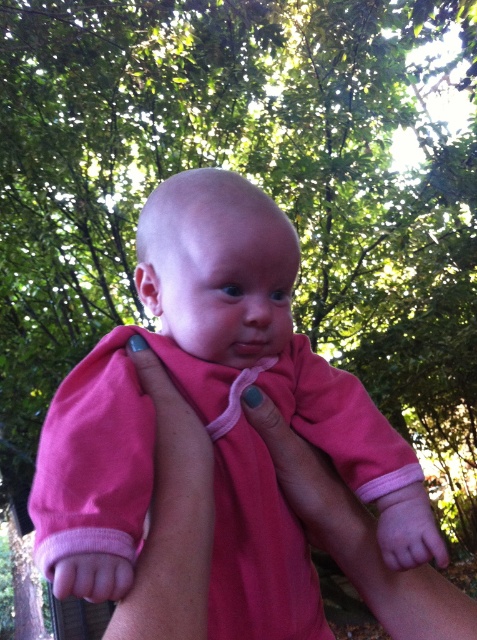
You are a photographer taking a picture of the baby and the arm holding it. You need to ensure both the pink soft fabric baby at center and the pink soft fabric arm at center are in focus. Given that the camera can only focus on objects within a 10 cm height difference, will both be in focus?

The pink soft fabric baby at center is much taller than the pink soft fabric arm at center. Since the height difference exceeds 10 cm, the camera may not be able to focus on both simultaneously.

You are a photographer trying to capture the baby in the image. You need to decide which part of the pink fabric at center or the pink soft fabric arm at center should be in focus to ensure the baby is clearly visible. Which one should you focus on?

The pink fabric at center is not as tall as pink soft fabric arm at center, so focusing on the pink soft fabric arm at center would ensure the baby is clearly visible since it is taller and closer to the baby.